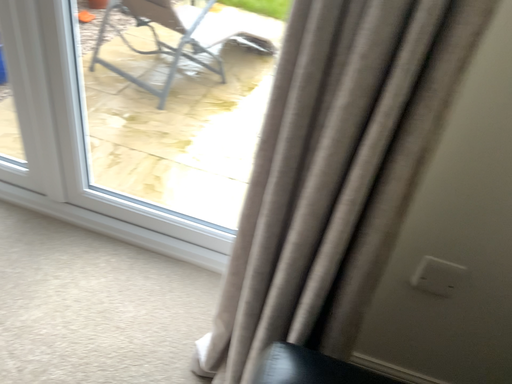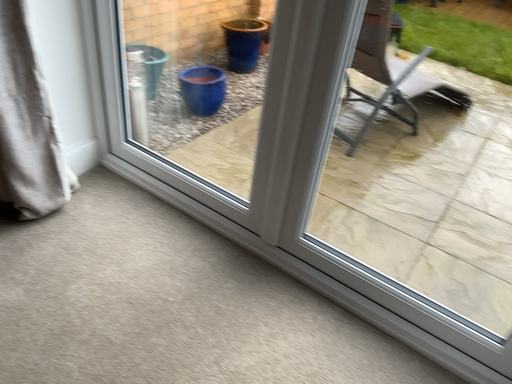
Question: Which way did the camera rotate in the video?

Choices:
 (A) rotated upward
 (B) rotated downward

Answer: (A)